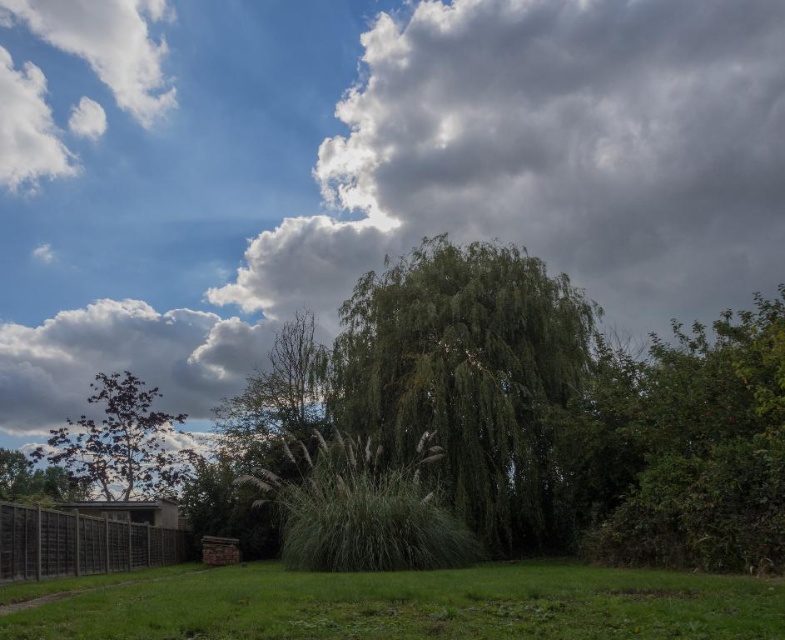
You are planning to plant a new tree in your backyard. You have two options from the image, the green leafy willow at center and the green leafy tree at lower left. Considering their widths, which tree would be more suitable if you want a narrower tree for space constraints?

The green leafy willow at center has a smaller width compared to the green leafy tree at lower left, making it more suitable for space constraints as it is narrower.

You are a gardener planning to mow the green grassy at lower center. Considering the height difference between it and the white fluffy cloud at upper left, do you think the grass is within the standard mowing height range for most lawns?

The green grassy at lower center is shorter than the white fluffy cloud at upper left. However, since clouds are not a standard measurement for grass height, the grass is likely within the typical mowing range for most lawns as it appears well maintained and green.